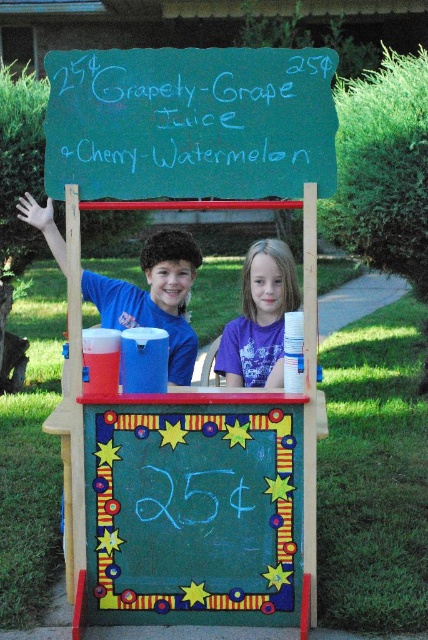
Can you confirm if green chalkboard at upper center is shorter than blue t-shirt at left?

Yes, green chalkboard at upper center is shorter than blue t-shirt at left.

Can you confirm if green chalkboard at upper center is positioned above blue t-shirt at left?

Yes.

Does point (246, 173) come in front of point (104, 292)?

Yes, it is in front of point (104, 292).

Where is `green chalkboard at upper center`? The width and height of the screenshot is (428, 640). green chalkboard at upper center is located at coordinates (190, 122).

Does point (174, 593) come in front of point (137, 154)?

That is False.

Does decorative chalkboard at center have a greater height compared to green chalkboard at upper center?

Yes.

The height and width of the screenshot is (640, 428). I want to click on decorative chalkboard at center, so click(193, 512).

You are a GUI agent. You are given a task and a screenshot of the screen. Output one action in this format:
    pyautogui.click(x=<x>, y=<y>)
    Task: Click on the decorative chalkboard at center
    The image size is (428, 640).
    Given the screenshot: What is the action you would take?
    pyautogui.click(x=193, y=512)

Is point (107, 156) farther from camera compared to point (276, 272)?

No, (107, 156) is closer to viewer.

Between green chalkboard at upper center and purple cotton shirt at center, which one has more height?

purple cotton shirt at center is taller.

What do you see at coordinates (190, 122) in the screenshot?
I see `green chalkboard at upper center` at bounding box center [190, 122].

I want to click on green chalkboard at upper center, so click(x=190, y=122).